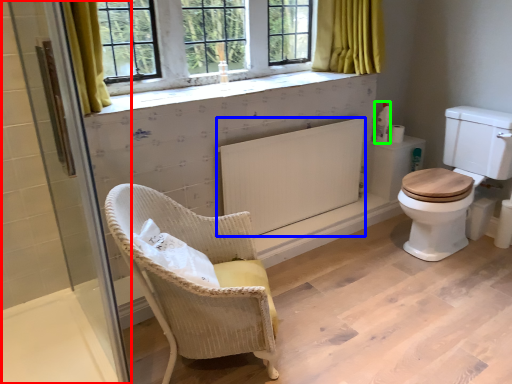
Question: Which object is positioned farthest from screen door (highlighted by a red box)? Select from radiator (highlighted by a blue box) and toiletries (highlighted by a green box).

Choices:
 (A) radiator
 (B) toiletries

Answer: (B)